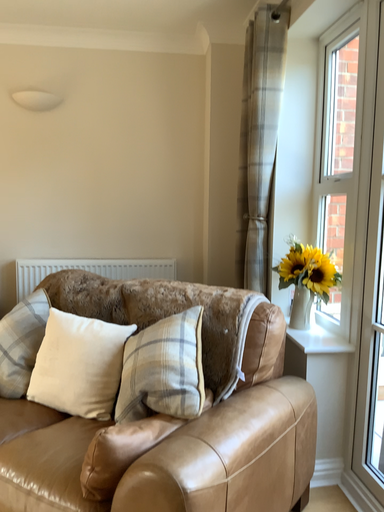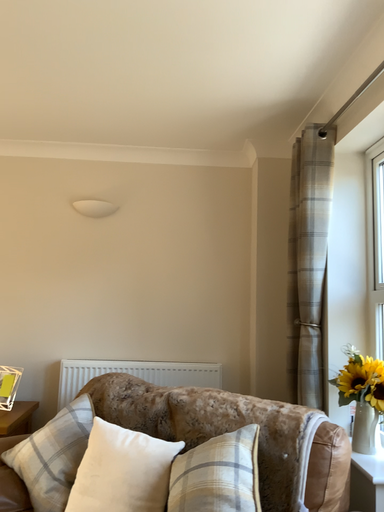
Question: How did the camera likely rotate when shooting the video?

Choices:
 (A) rotated upward
 (B) rotated downward

Answer: (A)